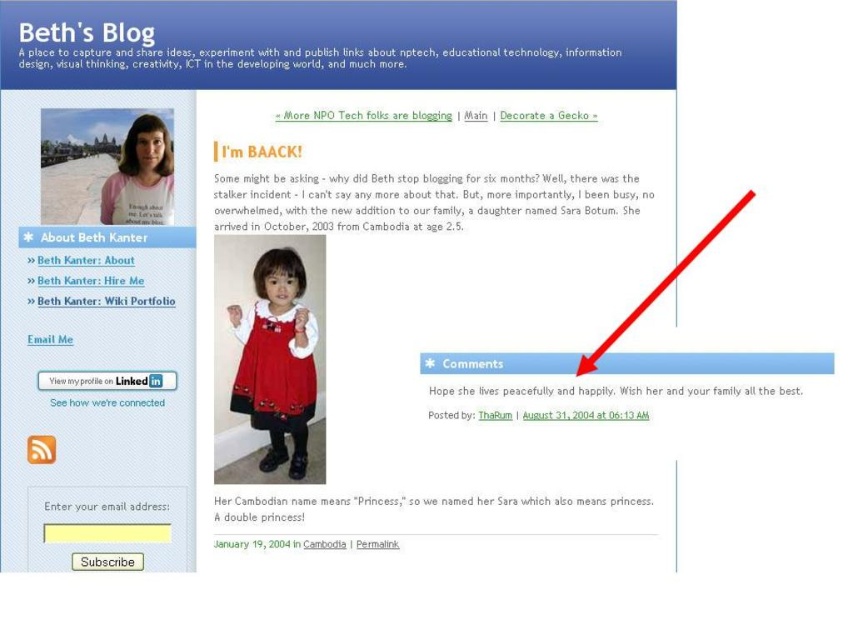
You are a fashion designer looking at two dresses displayed on a webpage. The red velvet dress at center and the matte white dress at upper left. Which dress takes up more space on the webpage?

The red velvet dress at center has a larger size compared to matte white dress at upper left, so it takes up more space on the webpage.

You are a fashion designer looking at the webpage layout. The red velvet dress at center and the matte white dress at upper left are both featured. Which dress is placed lower on the page?

The red velvet dress at center is positioned under the matte white dress at upper left, so it is placed lower on the page.

You are trying to decide which dress to wear to a formal event. You see a red velvet dress at center and a matte white dress at upper left. Which dress is wider?

The red velvet dress at center is wider than the matte white dress at upper left.